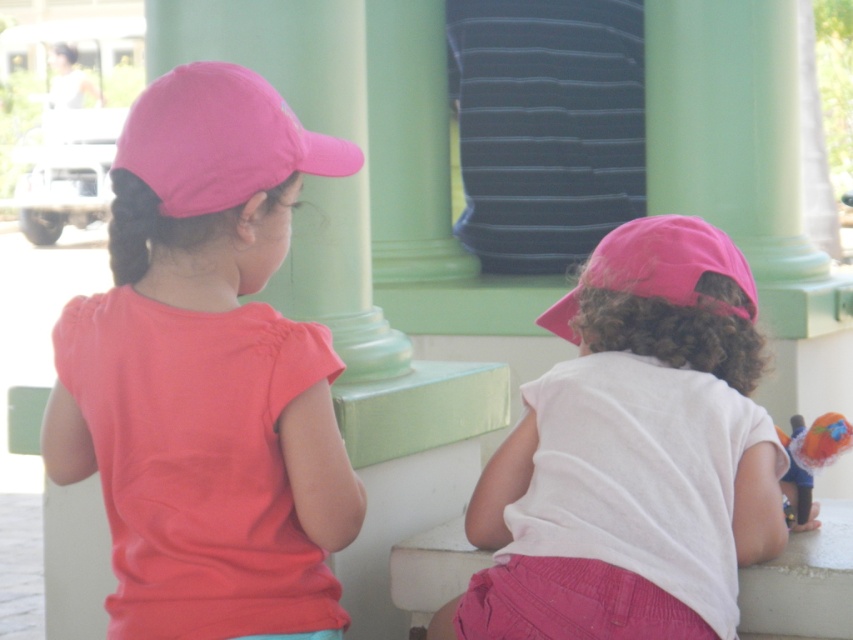
You are a photographer trying to capture both the matte pink cap at upper left and the pink fabric cap at upper left in a single frame. Since you want to include both caps in the photo, which cap should you position closer to the left edge of the frame to ensure both are visible?

The matte pink cap at upper left is positioned on the left side of pink fabric cap at upper left, so positioning the matte pink cap at upper left closer to the left edge of the frame will ensure both caps are visible in the photo.